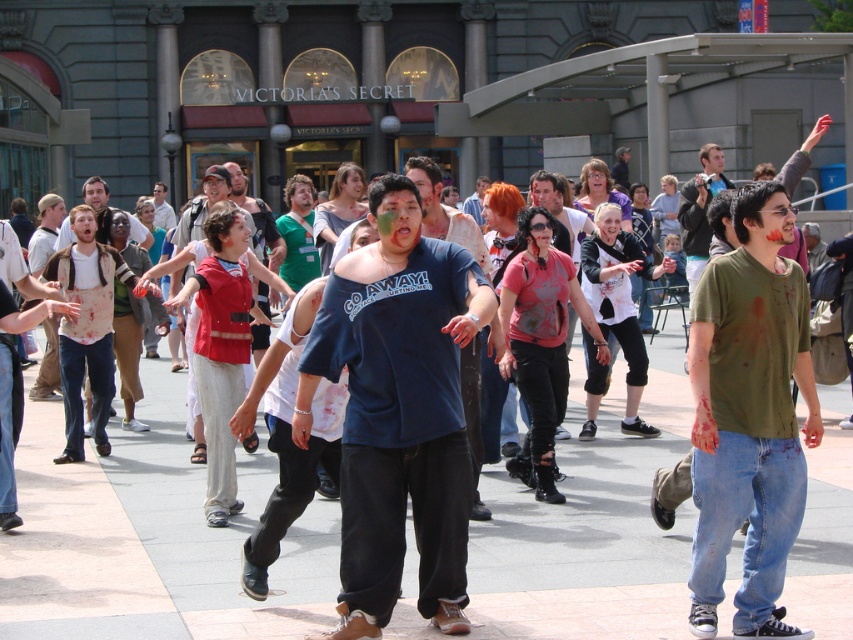
You are a photographer trying to capture a wide shot of the zombie event. You need to ensure that both the gray concrete pavement at center and the matte red shirt at center are clearly visible in the frame. Given their sizes, which object should you focus on to ensure both are in focus?

The gray concrete pavement at center has a larger size compared to matte red shirt at center. To ensure both are in focus, you should focus on the larger object, gray concrete pavement at center, as it will have a greater depth of field coverage.